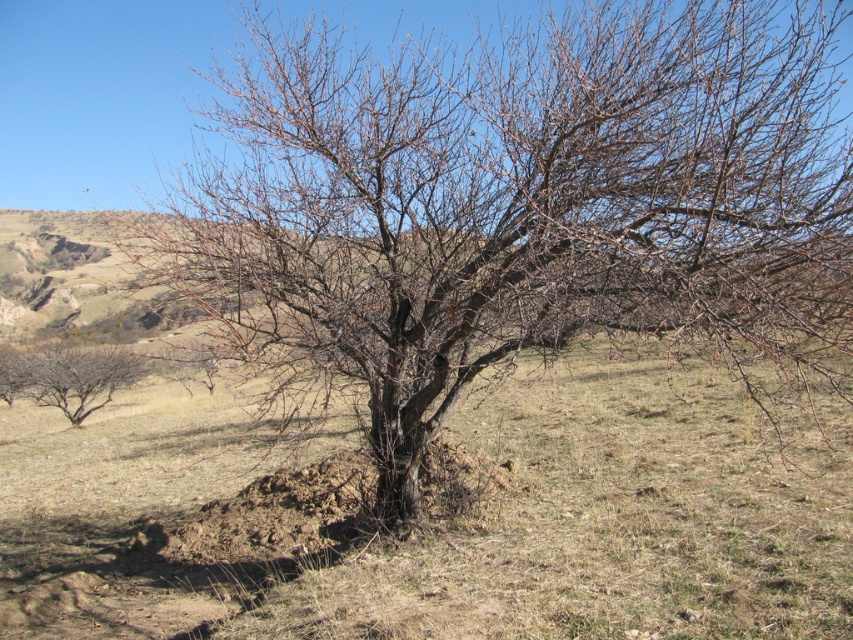
Question: Is bare branches at left bigger than bare branches at lower left?

Choices:
 (A) no
 (B) yes

Answer: (A)

Question: Which object is farther from the camera taking this photo?

Choices:
 (A) bare branches at left
 (B) bare branches at lower left

Answer: (B)

Question: Is bare branches at left below bare branches at lower left?

Choices:
 (A) yes
 (B) no

Answer: (A)

Question: Can you confirm if bare branches at left is positioned below bare branches at lower left?

Choices:
 (A) no
 (B) yes

Answer: (B)